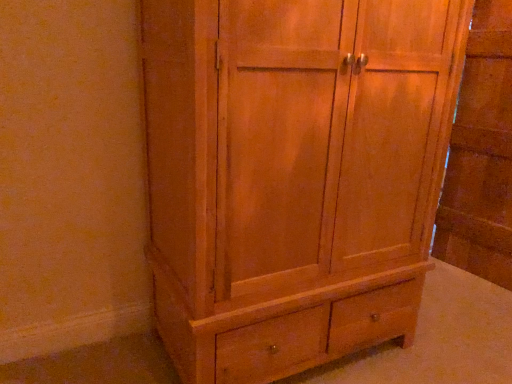
Question: Is natural wood cabinet at right bigger or smaller than natural wood cupboard at center?

Choices:
 (A) big
 (B) small

Answer: (B)

Question: Is natural wood cabinet at right inside the boundaries of natural wood cupboard at center, or outside?

Choices:
 (A) outside
 (B) inside

Answer: (A)

Question: Is natural wood cabinet at right taller or shorter than natural wood cupboard at center?

Choices:
 (A) short
 (B) tall

Answer: (B)

Question: Is natural wood cupboard at center to the left or to the right of natural wood cabinet at right in the image?

Choices:
 (A) left
 (B) right

Answer: (A)

Question: From a real-world perspective, is natural wood cupboard at center physically located above or below natural wood cabinet at right?

Choices:
 (A) below
 (B) above

Answer: (A)

Question: In terms of size, does natural wood cupboard at center appear bigger or smaller than natural wood cabinet at right?

Choices:
 (A) small
 (B) big

Answer: (B)

Question: Is point (244, 215) positioned closer to the camera than point (459, 94)?

Choices:
 (A) closer
 (B) farther

Answer: (A)